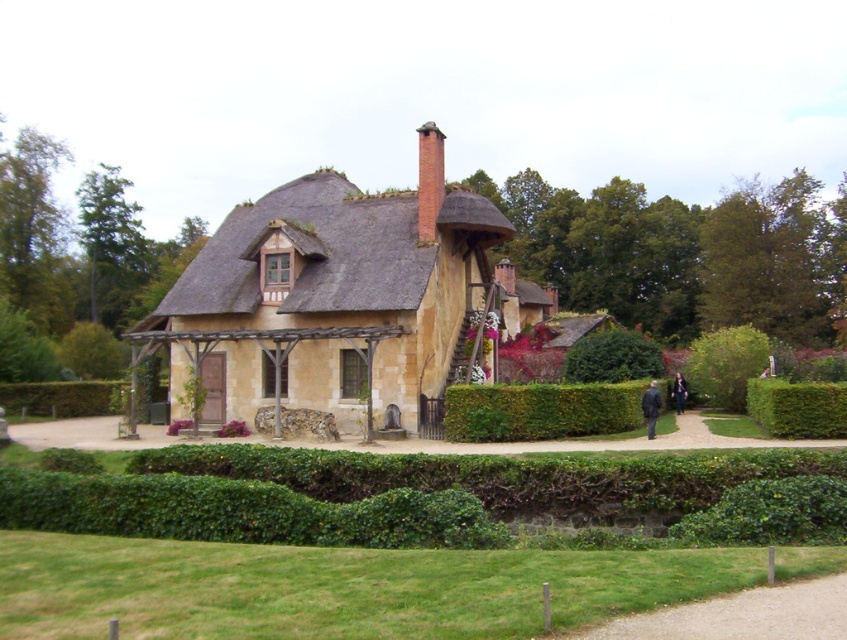
You are a visitor approaching the house and notice the green leafy hedge at lower right and the brick chimney at upper center. Which object is taller when viewed from the front of the house?

The brick chimney at upper center is taller than the green leafy hedge at lower right.